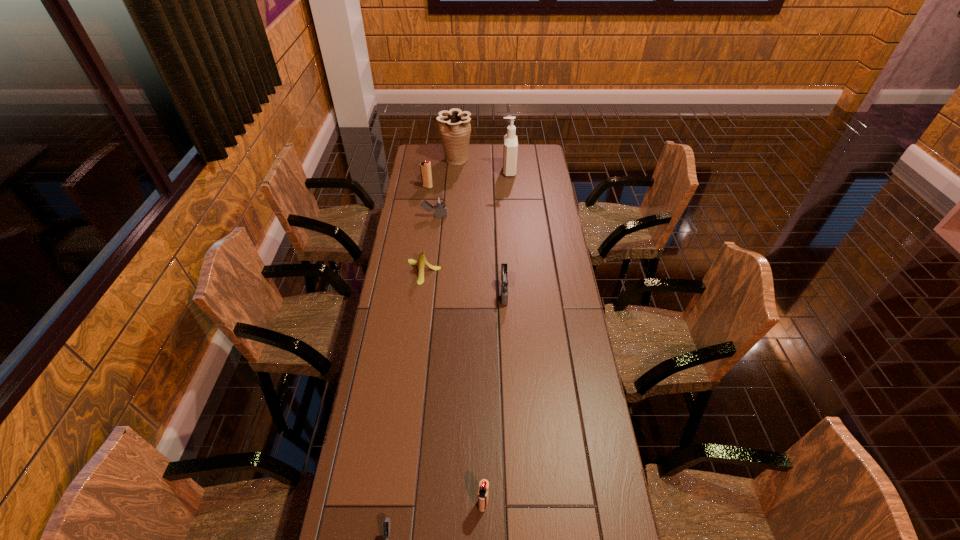
Where is `the second nearest object`? the second nearest object is located at coordinates (483, 492).

The image size is (960, 540). I want to click on free space located on the front label of the tallest object, so click(488, 171).

This screenshot has width=960, height=540. Find the location of `vacant region located 0.120m on the front label of the tallest object`. vacant region located 0.120m on the front label of the tallest object is located at coordinates (479, 171).

Identify the location of vacant region located on the front label of the tallest object. (441, 171).

The width and height of the screenshot is (960, 540). Identify the location of blank space located 0.070m on the back of the seventh shortest object. (457, 144).

You are a GUI agent. You are given a task and a screenshot of the screen. Output one action in this format:
    pyautogui.click(x=<x>, y=<y>)
    Task: Click on the free spot located on the left of the sixth nearest object
    The image size is (960, 540).
    Given the screenshot: What is the action you would take?
    pyautogui.click(x=412, y=187)

Find the location of a particular element. This screenshot has width=960, height=540. free space located 0.110m on the back of the second nearest gray igniter is located at coordinates (502, 260).

Where is `free space located on the right of the banana`? The image size is (960, 540). free space located on the right of the banana is located at coordinates (507, 272).

At what (x,y) coordinates should I click in order to perform the action: click on vacant space positioned on the back of the second biggest gray igniter. Please return your answer as a coordinate pair (x, y). Image resolution: width=960 pixels, height=540 pixels. Looking at the image, I should click on (439, 182).

Where is `vacant region located 0.350m on the back of the smaller red igniter`? This screenshot has width=960, height=540. vacant region located 0.350m on the back of the smaller red igniter is located at coordinates (483, 382).